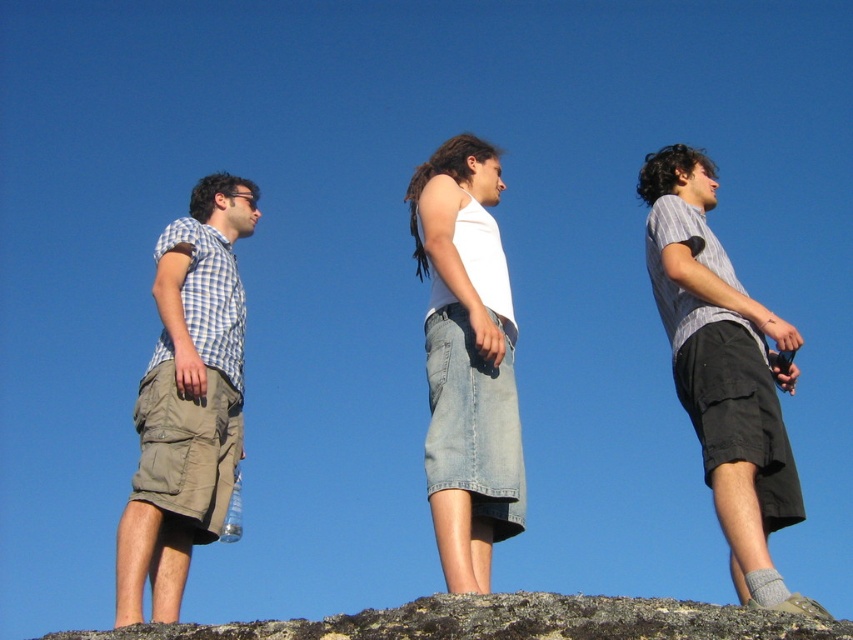
You are a photographer trying to capture a group photo of the light brown cargo shorts at left and the striped cotton shirt at right. Since you want to ensure both subjects are clearly visible, which clothing item should you focus on first to avoid blurriness due to their size differences?

The light brown cargo shorts at left has a lesser width compared to the striped cotton shirt at right, so you should focus on the striped cotton shirt at right first because it is larger and might be easier to capture clearly.

From the picture: You are standing at the origin point looking towards the three people. Which direction should you move to reach the striped cotton shirt at right first?

Since the striped cotton shirt at right is located at point (723, 371), you should move towards the right direction to reach it first.

You are standing at the base of a tree and see two points marked in the scene. The first point is at coordinate point [485,192] and the second is at point [541,604]. Which point is closer to you?

Point [541,604] is closer to you since it is in front of point [485,192].